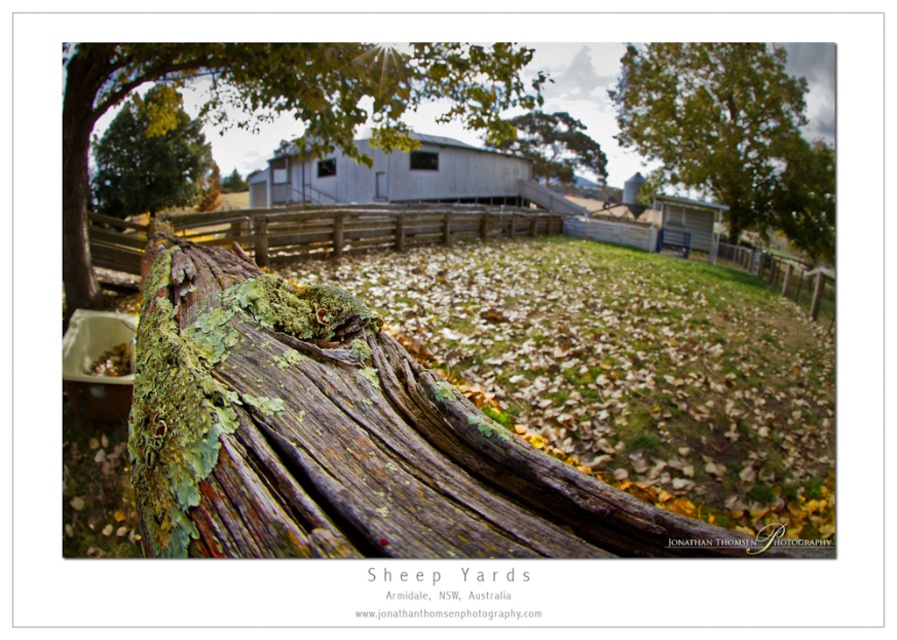
Can you confirm if weathered wood fence at center is thinner than gray metallic barn at center?

Yes.

Who is more forward, (274, 259) or (467, 192)?

Point (274, 259) is more forward.

Between point (277, 244) and point (347, 168), which one is positioned in front?

Positioned in front is point (277, 244).

Locate an element on the screen. The width and height of the screenshot is (897, 640). weathered wood fence at center is located at coordinates (356, 227).

Is weathered wood fence at center further to camera compared to green mossy wood at upper left?

No, weathered wood fence at center is closer to the viewer.

Between weathered wood fence at center and green mossy wood at upper left, which one appears on the left side from the viewer's perspective?

green mossy wood at upper left

Which is in front, point (285, 214) or point (103, 145)?

Positioned in front is point (285, 214).

The image size is (897, 640). What are the coordinates of `weathered wood fence at center` in the screenshot? It's located at (356, 227).

Is point (414, 387) farther from viewer compared to point (512, 124)?

No.

Is green mossy wood at left taller than green mossy wood at upper center?

No.

Is point (327, 385) positioned behind point (523, 140)?

No, (327, 385) is closer to viewer.

Where is `green mossy wood at left`? This screenshot has height=640, width=897. green mossy wood at left is located at coordinates (344, 438).